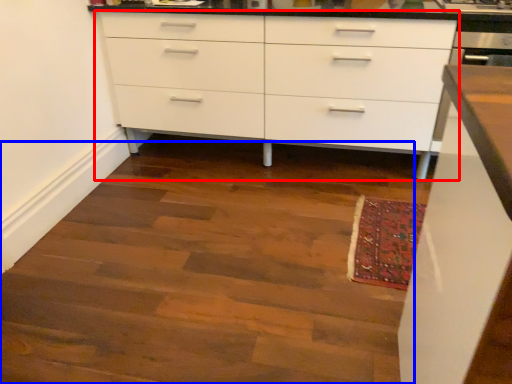
Question: Which point is further to the camera, chest of drawers (highlighted by a red box) or stairwell (highlighted by a blue box)?

Choices:
 (A) chest of drawers
 (B) stairwell

Answer: (A)